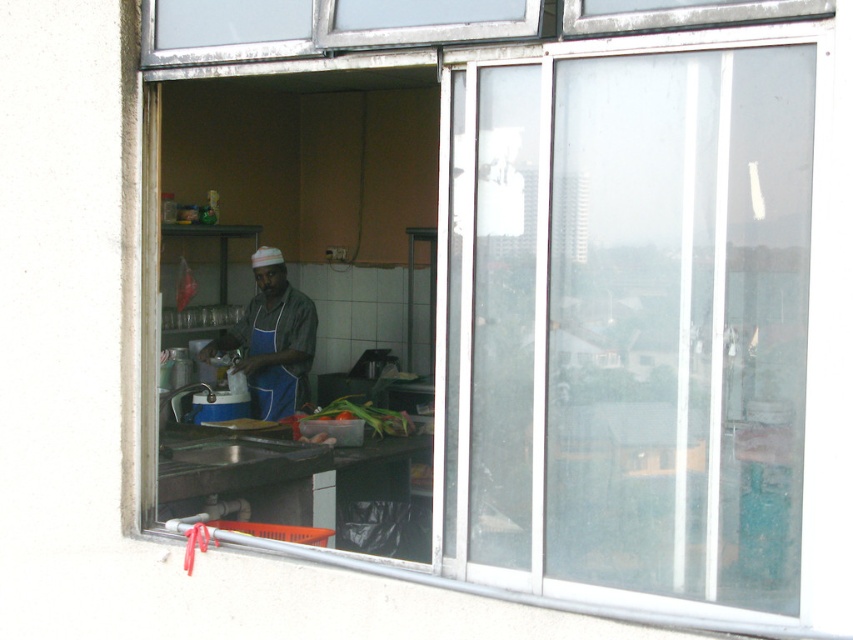
Question: Does blue apron at center appear on the right side of blue fabric apron at center?

Choices:
 (A) no
 (B) yes

Answer: (A)

Question: Which point is closer to the camera taking this photo?

Choices:
 (A) (341, 408)
 (B) (264, 404)
 (C) (229, 336)

Answer: (A)

Question: Observing the image, what is the correct spatial positioning of blue fabric apron at center in reference to translucent plastic container at center?

Choices:
 (A) right
 (B) left

Answer: (B)

Question: Which is farther from the blue fabric apron at center?

Choices:
 (A) blue apron at center
 (B) translucent plastic container at center

Answer: (B)

Question: Estimate the real-world distances between objects in this image. Which object is farther from the blue fabric apron at center?

Choices:
 (A) blue apron at center
 (B) translucent plastic container at center

Answer: (B)

Question: Is blue apron at center wider than translucent plastic container at center?

Choices:
 (A) yes
 (B) no

Answer: (A)